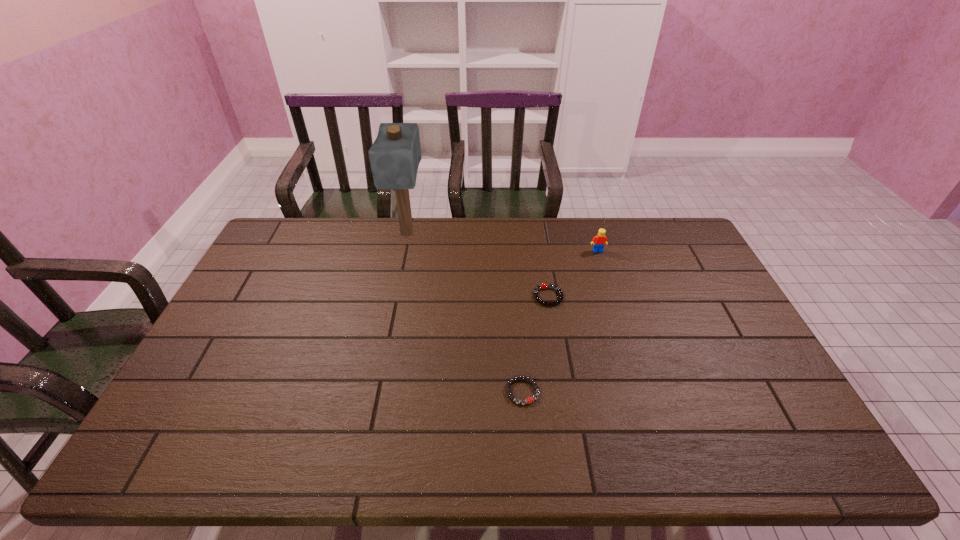
Identify the location of mallet. (395, 155).

The height and width of the screenshot is (540, 960). I want to click on the leftmost object, so click(395, 155).

This screenshot has width=960, height=540. In order to click on the second tallest object in this screenshot , I will do `click(600, 240)`.

Find the location of a particular element. This screenshot has height=540, width=960. Lego is located at coordinates (600, 240).

The width and height of the screenshot is (960, 540). I want to click on the second nearest object, so click(x=543, y=286).

The width and height of the screenshot is (960, 540). I want to click on the farther bracelet, so [543, 286].

The width and height of the screenshot is (960, 540). I want to click on the nearest object, so click(528, 400).

At what (x,y) coordinates should I click in order to perform the action: click on the second object from left to right. Please return your answer as a coordinate pair (x, y). Looking at the image, I should click on (528, 400).

You are a GUI agent. You are given a task and a screenshot of the screen. Output one action in this format:
    pyautogui.click(x=<x>, y=<y>)
    Task: Click on the vacant region located 0.370m on the front of the mallet
    
    Given the screenshot: What is the action you would take?
    pyautogui.click(x=387, y=334)

At what (x,y) coordinates should I click in order to perform the action: click on vacant space situated on the face of the rightmost object. Please return your answer as a coordinate pair (x, y). The width and height of the screenshot is (960, 540). Looking at the image, I should click on (603, 266).